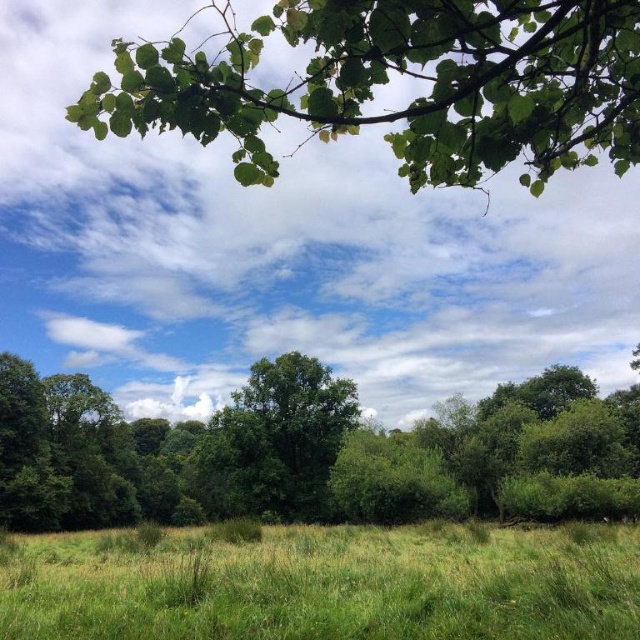
Question: Among these objects, which one is nearest to the camera?

Choices:
 (A) green leafy branch at upper center
 (B) green leafy tree at center
 (C) green leafy forest at center

Answer: (A)

Question: Where is green leafy forest at center located in relation to green grass at lower center in the image?

Choices:
 (A) left
 (B) right

Answer: (B)

Question: Does green grass at lower center appear on the right side of green leafy tree at center?

Choices:
 (A) no
 (B) yes

Answer: (B)

Question: Which point is closer to the camera?

Choices:
 (A) (614, 554)
 (B) (273, 500)
 (C) (305, 364)

Answer: (A)

Question: Can you confirm if green grass at lower center is wider than green leafy tree at center?

Choices:
 (A) yes
 (B) no

Answer: (A)

Question: Which point appears farthest from the camera in this image?

Choices:
 (A) (403, 58)
 (B) (394, 529)
 (C) (332, 424)

Answer: (C)